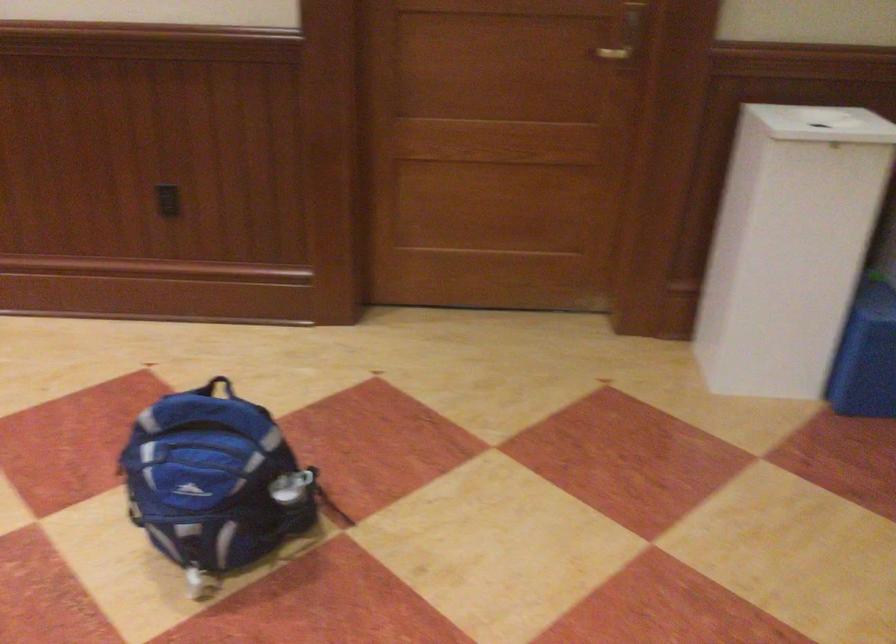
The height and width of the screenshot is (644, 896). I want to click on backpack handle, so click(x=217, y=386).